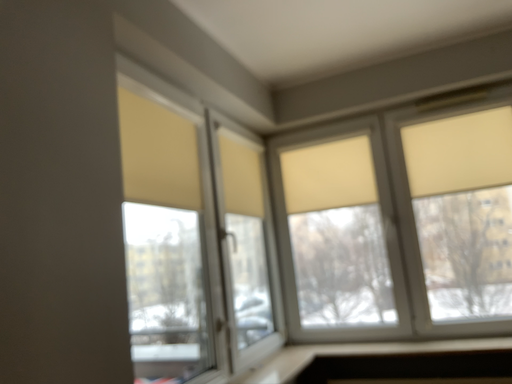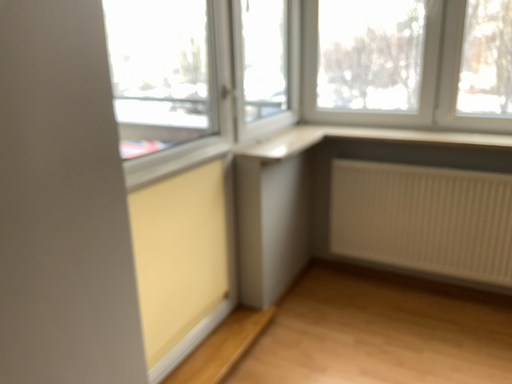
Question: How did the camera likely rotate when shooting the video?

Choices:
 (A) rotated downward
 (B) rotated upward

Answer: (A)